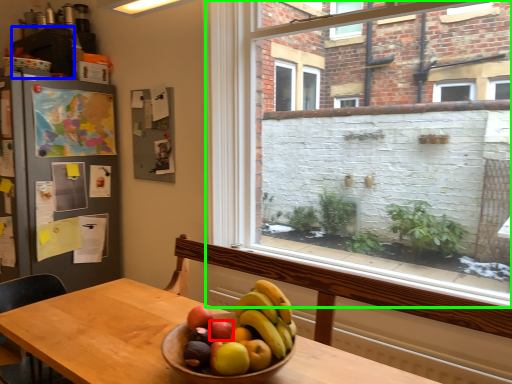
Question: Considering the real-world distances, which object is closest to apple (highlighted by a red box)? cabinetry (highlighted by a blue box) or window (highlighted by a green box).

Choices:
 (A) cabinetry
 (B) window

Answer: (B)